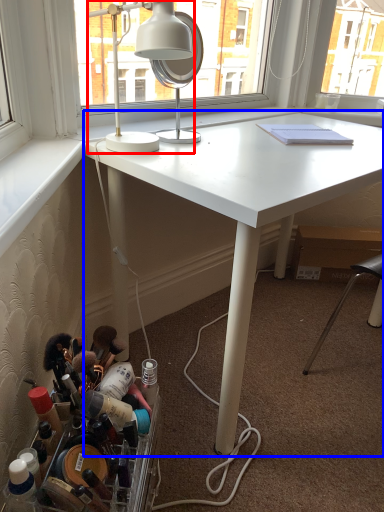
Question: Which of the following is the farthest to the observer, lamp (highlighted by a red box) or desk (highlighted by a blue box)?

Choices:
 (A) lamp
 (B) desk

Answer: (A)